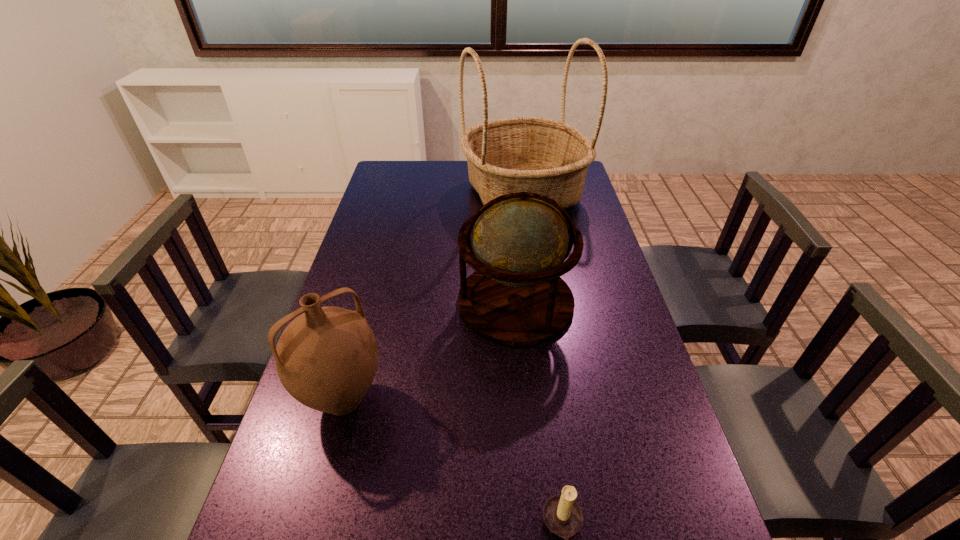
Locate an element on the screen. object present at the far edge is located at coordinates (548, 157).

Where is `object situated at the left edge`? object situated at the left edge is located at coordinates (326, 358).

Where is `basket positioned at the right edge`? The width and height of the screenshot is (960, 540). basket positioned at the right edge is located at coordinates (548, 157).

Identify the location of globe located in the right edge section of the desktop. This screenshot has height=540, width=960. (516, 297).

Find the location of a particular element. object that is at the far right corner is located at coordinates [548, 157].

Where is `free space at the far edge`? free space at the far edge is located at coordinates (453, 188).

You are a GUI agent. You are given a task and a screenshot of the screen. Output one action in this format:
    pyautogui.click(x=<x>, y=<y>)
    Task: Click on the free space at the left edge of the desktop
    The width and height of the screenshot is (960, 540).
    Given the screenshot: What is the action you would take?
    pyautogui.click(x=348, y=443)

This screenshot has height=540, width=960. In order to click on vacant area at the right edge in this screenshot , I will do `click(631, 367)`.

Locate an element on the screen. free space between the leftmost object and the tallest object is located at coordinates (433, 296).

Locate an element on the screen. Image resolution: width=960 pixels, height=540 pixels. vacant space that's between the pitcher and the tallest object is located at coordinates [x=433, y=296].